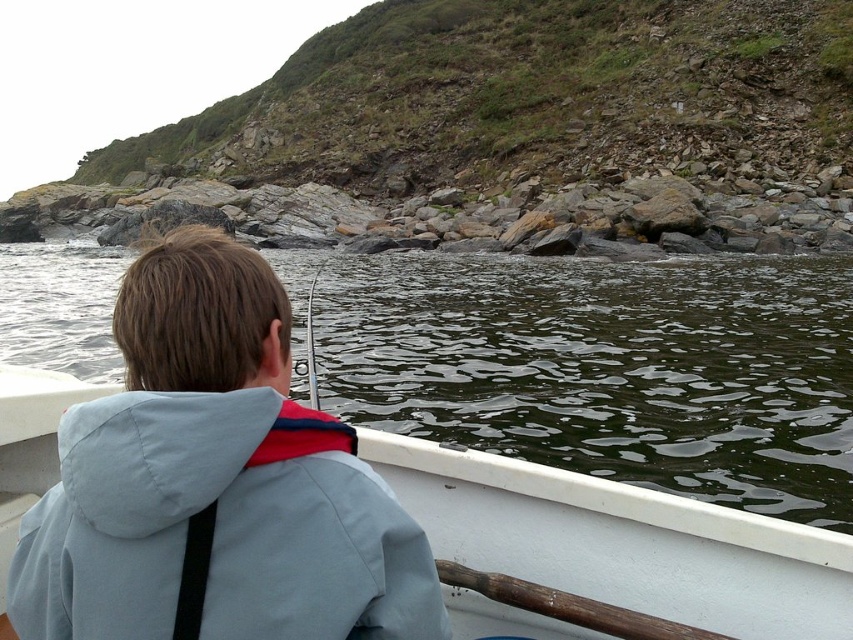
You are standing on the rocky shoreline and see the light blue fabric jacket at upper left and the white matte canoe at center in the water. Which object is higher in elevation?

The light blue fabric jacket at upper left is above the white matte canoe at center, so it is higher in elevation.